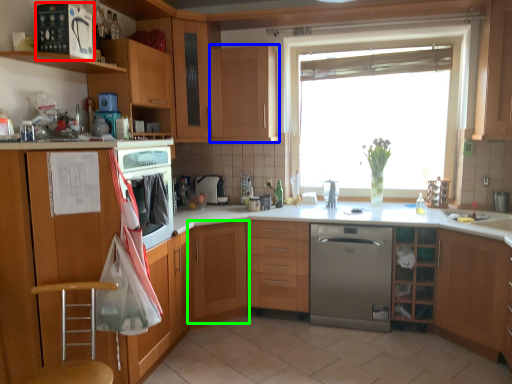
Question: Which is nearer to the kitchen appliance (highlighted by a red box)? cabinetry (highlighted by a blue box) or cabinetry (highlighted by a green box).

Choices:
 (A) cabinetry
 (B) cabinetry

Answer: (A)